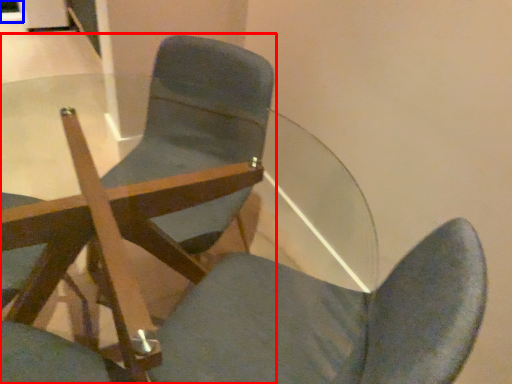
Question: Which object appears farthest to the camera in this image, chair (highlighted by a red box) or glass door (highlighted by a blue box)?

Choices:
 (A) chair
 (B) glass door

Answer: (B)